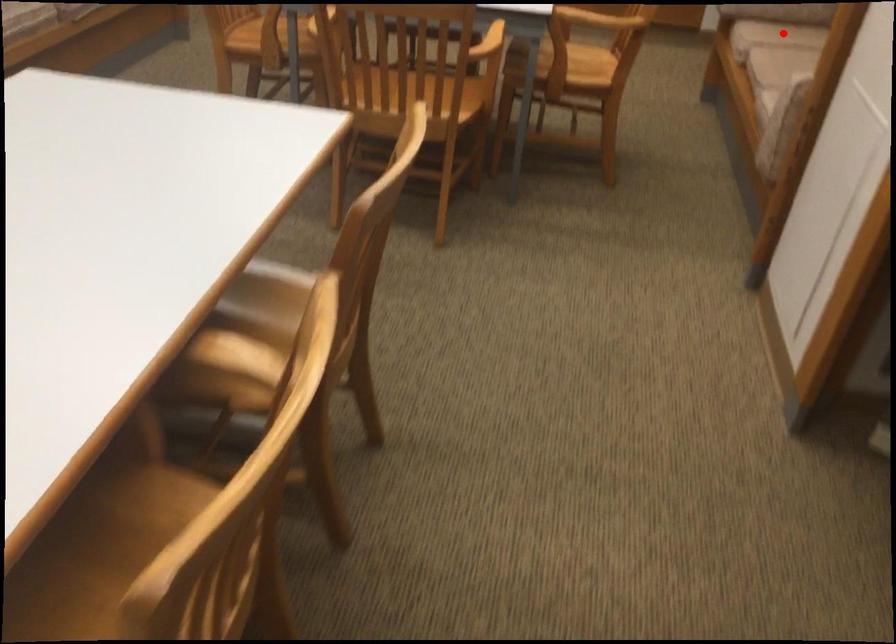
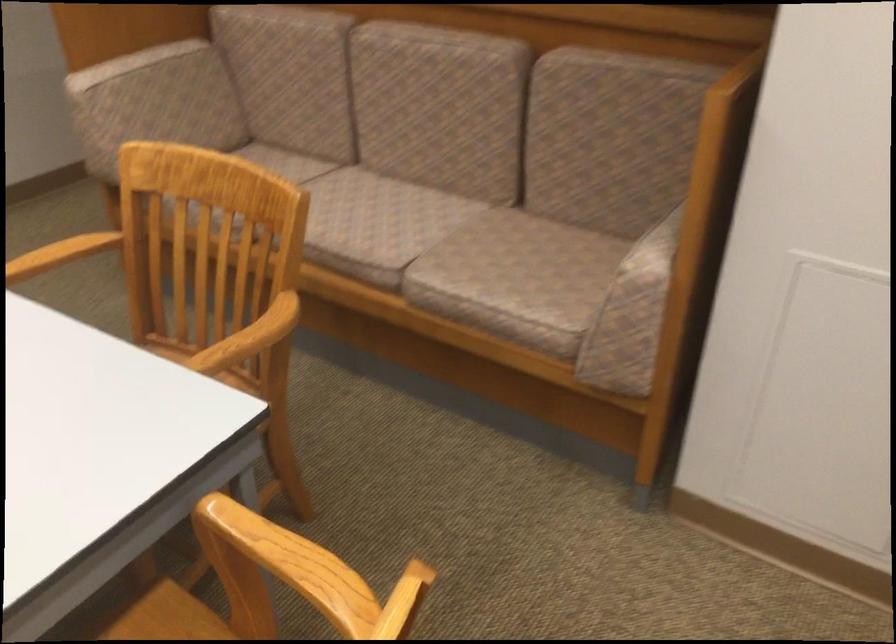
Question: I am providing you with two images of the same scene from different viewpoints. A red point is marked on the first image. Can you still see the location of the red point in image 2?

Choices:
 (A) Yes
 (B) No

Answer: (B)